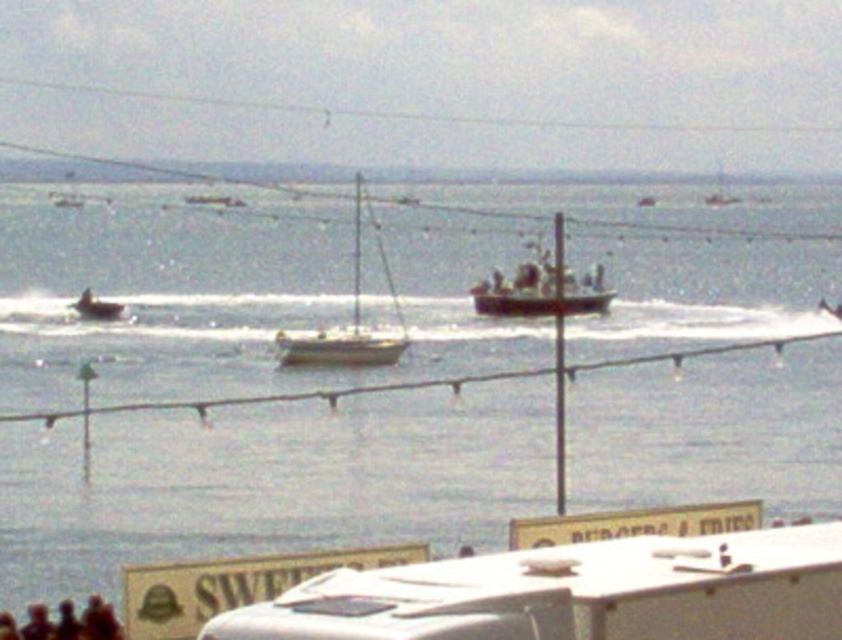
Question: Estimate the real-world distances between objects in this image. Which object is closer to the white matte trailer truck at lower center?

Choices:
 (A) white wooden sailboat at center
 (B) clear water at center
 (C) metallic red boat at center

Answer: (C)

Question: Is white matte trailer truck at lower center smaller than smooth white boat at left?

Choices:
 (A) no
 (B) yes

Answer: (B)

Question: Which object is closer to the camera taking this photo?

Choices:
 (A) metallic red boat at center
 (B) white wooden sailboat at center
 (C) white matte sailboat at center
 (D) white matte trailer truck at lower center

Answer: (D)

Question: Considering the real-world distances, which object is farthest from the white matte sailboat at center?

Choices:
 (A) white wooden sailboat at center
 (B) metallic red boat at center
 (C) smooth white boat at left

Answer: (A)

Question: Can you confirm if smooth white boat at left is positioned above white wooden sailboat at center?

Choices:
 (A) yes
 (B) no

Answer: (B)

Question: Does metallic red boat at center lie in front of white matte sailboat at center?

Choices:
 (A) yes
 (B) no

Answer: (A)